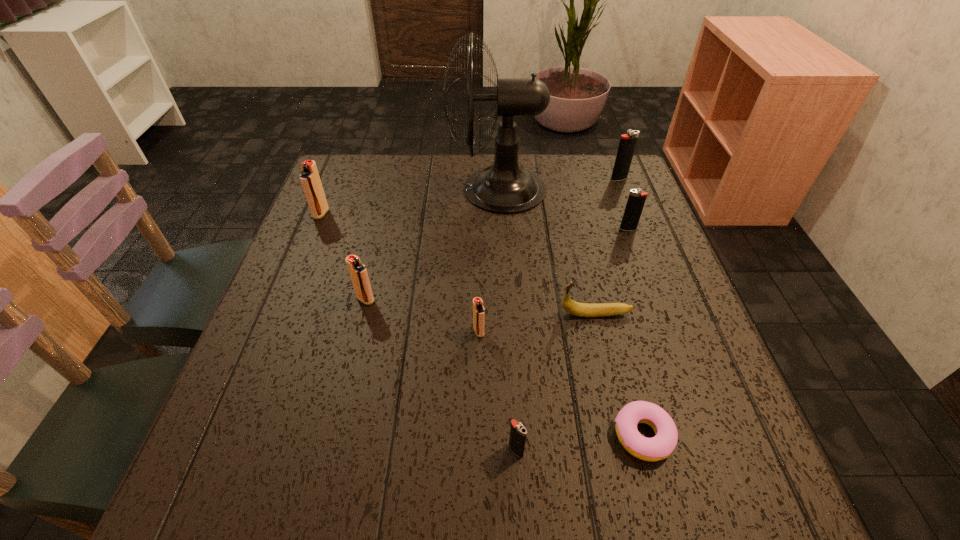
The height and width of the screenshot is (540, 960). In order to click on black igniter that is the second nearest to the third farthest igniter in this screenshot , I will do `click(518, 432)`.

Locate an element on the screen. This screenshot has height=540, width=960. black igniter that is the nearest to the leftmost black igniter is located at coordinates (636, 200).

This screenshot has width=960, height=540. I want to click on vacant space that satisfies the following two spatial constraints: 1. on the front side of the leftmost black igniter; 2. on the left side of the leftmost red igniter, so click(x=226, y=450).

The height and width of the screenshot is (540, 960). In order to click on free space that satisfies the following two spatial constraints: 1. on the front-facing side of the tallest object; 2. on the left side of the doughnut in this screenshot , I will do `click(510, 435)`.

Locate an element on the screen. The image size is (960, 540). vacant area that satisfies the following two spatial constraints: 1. on the front-facing side of the fan; 2. on the right side of the second nearest black igniter is located at coordinates (499, 229).